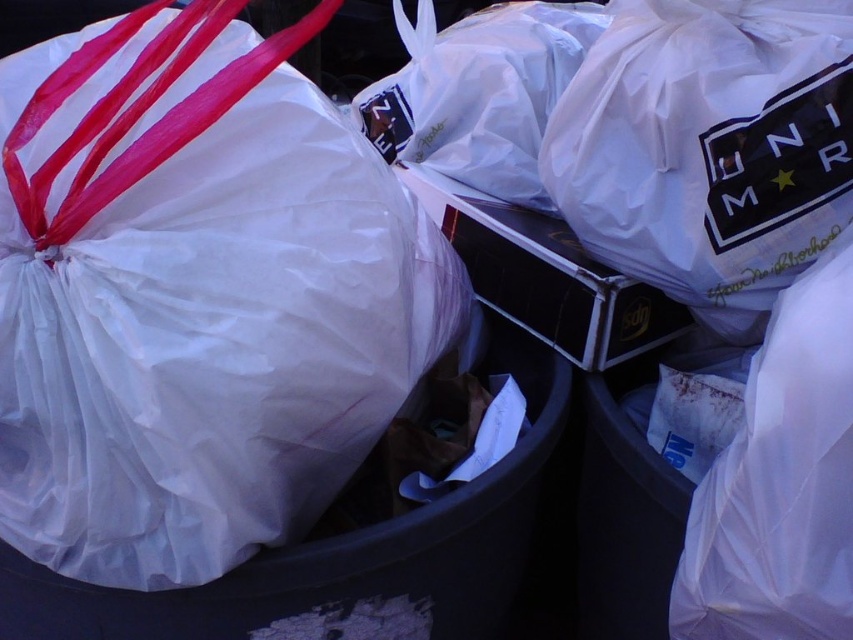
Question: Can you confirm if white plastic bag at left is positioned above white plastic bag at upper right?

Choices:
 (A) yes
 (B) no

Answer: (B)

Question: Can you confirm if white plastic bag at left is thinner than white plastic bag at upper right?

Choices:
 (A) no
 (B) yes

Answer: (A)

Question: Which object appears closest to the camera in this image?

Choices:
 (A) white plastic bag at upper right
 (B) white plastic bag at left

Answer: (B)

Question: Can you confirm if white plastic bag at left is wider than white plastic bag at upper right?

Choices:
 (A) no
 (B) yes

Answer: (B)

Question: Which of the following is the farthest from the observer?

Choices:
 (A) (22, 81)
 (B) (587, 227)

Answer: (B)

Question: Which point appears farthest from the camera in this image?

Choices:
 (A) (286, 32)
 (B) (733, 51)

Answer: (B)